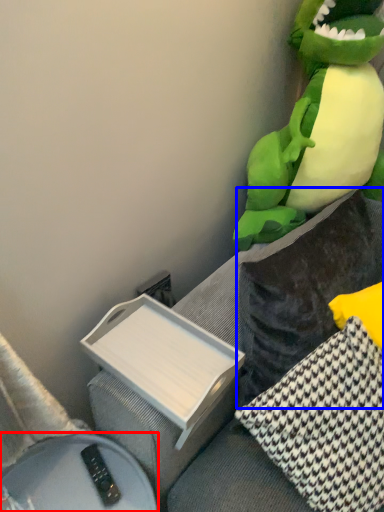
Question: Which of the following is the farthest to the observer, furniture (highlighted by a red box) or pillow (highlighted by a blue box)?

Choices:
 (A) furniture
 (B) pillow

Answer: (A)